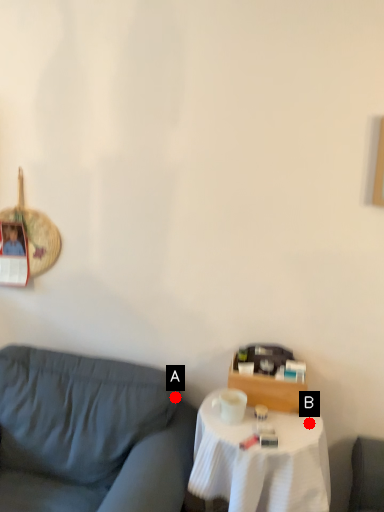
Question: Two points are circled on the image, labeled by A and B beside each circle. Which point is further to the camera?

Choices:
 (A) A is further
 (B) B is further

Answer: (A)